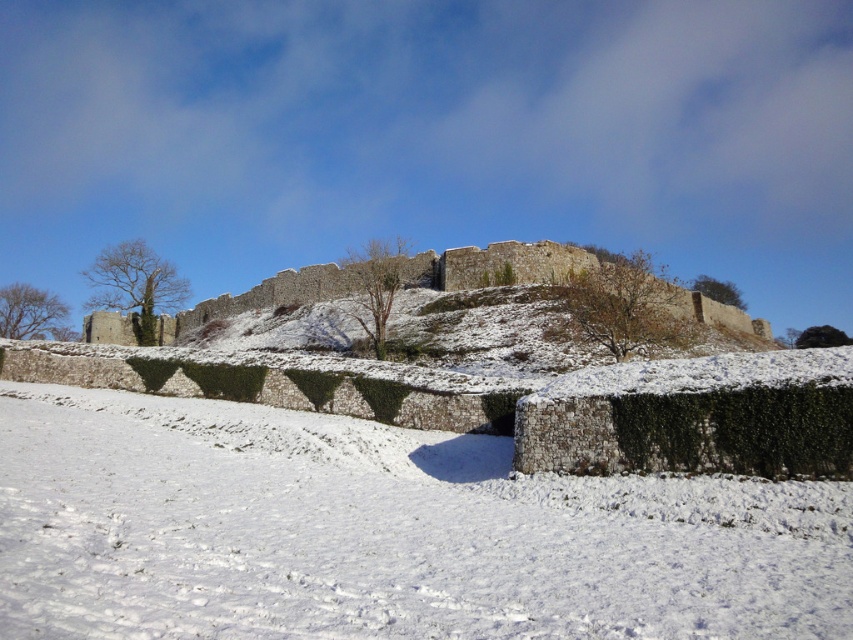
Question: From the image, what is the correct spatial relationship of white fluffy snow at center in relation to snow-covered stone wall at center?

Choices:
 (A) right
 (B) left

Answer: (A)

Question: Which object appears closest to the camera in this image?

Choices:
 (A) white fluffy snow at center
 (B) snow-covered stone wall at center

Answer: (A)

Question: Which point is closer to the camera?

Choices:
 (A) white fluffy snow at center
 (B) snow-covered stone wall at center

Answer: (A)

Question: Does white fluffy snow at center come behind snow-covered stone wall at center?

Choices:
 (A) no
 (B) yes

Answer: (A)

Question: Which point appears farthest from the camera in this image?

Choices:
 (A) (223, 300)
 (B) (447, 580)

Answer: (A)

Question: Is white fluffy snow at center smaller than snow-covered stone wall at center?

Choices:
 (A) yes
 (B) no

Answer: (A)